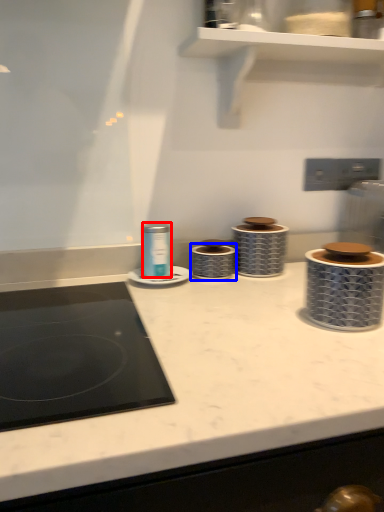
Question: Which object appears farthest to the camera in this image, appliance (highlighted by a red box) or appliance (highlighted by a blue box)?

Choices:
 (A) appliance
 (B) appliance

Answer: (B)